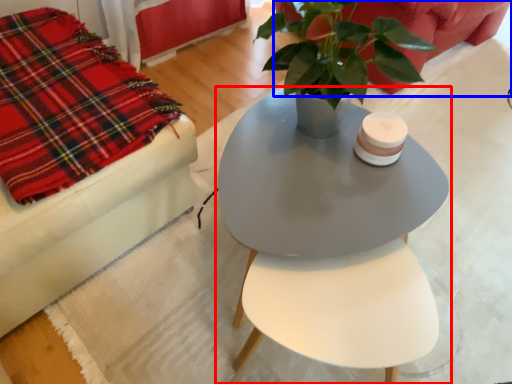
Question: Which of the following is the closest to the observer, table (highlighted by a red box) or couch (highlighted by a blue box)?

Choices:
 (A) table
 (B) couch

Answer: (A)